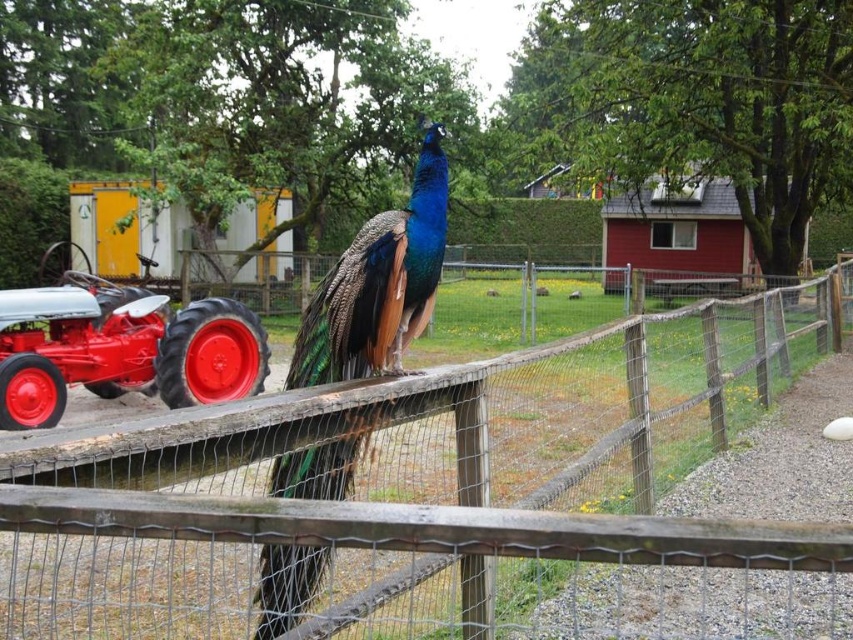
Does point (221, 573) come closer to viewer compared to point (132, 294)?

That is True.

Between wooden fence at center and red painted metal tractor at left, which one is positioned lower?

wooden fence at center is below.

Is point (511, 580) positioned after point (212, 314)?

That is False.

You are a GUI agent. You are given a task and a screenshot of the screen. Output one action in this format:
    pyautogui.click(x=<x>, y=<y>)
    Task: Click on the wooden fence at center
    This screenshot has height=640, width=853.
    Given the screenshot: What is the action you would take?
    pyautogui.click(x=437, y=500)

Does shiny blue-green peacock at center have a lesser width compared to red painted metal tractor at left?

Correct, shiny blue-green peacock at center's width is less than red painted metal tractor at left's.

Which is more to the left, shiny blue-green peacock at center or red painted metal tractor at left?

red painted metal tractor at left

Is point (413, 276) behind point (219, 307)?

No.

This screenshot has height=640, width=853. Find the location of `shiny blue-green peacock at center`. shiny blue-green peacock at center is located at coordinates (378, 285).

Who is positioned more to the left, wooden fence at center or shiny blue-green peacock at center?

From the viewer's perspective, shiny blue-green peacock at center appears more on the left side.

Can you confirm if wooden fence at center is smaller than shiny blue-green peacock at center?

No.

Based on the photo, who is more forward, (131, 572) or (332, 346)?

Positioned in front is point (332, 346).

Find the location of a particular element. The image size is (853, 640). wooden fence at center is located at coordinates (437, 500).